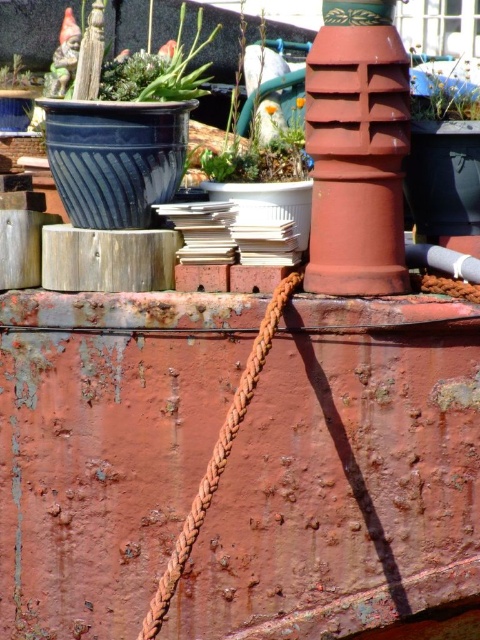
Does green matte plant at upper center appear under brown braided rope at center?

Incorrect, green matte plant at upper center is not positioned below brown braided rope at center.

Is green matte plant at upper center wider than brown braided rope at center?

No, green matte plant at upper center is not wider than brown braided rope at center.

Is point (248, 115) closer to camera compared to point (265, 339)?

That is False.

Where is `green matte plant at upper center`? This screenshot has height=640, width=480. green matte plant at upper center is located at coordinates (269, 120).

Is green matte plant at upper center taller than green leafy plant at upper right?

Yes, green matte plant at upper center is taller than green leafy plant at upper right.

Who is shorter, green matte plant at upper center or green leafy plant at upper right?

With less height is green leafy plant at upper right.

What do you see at coordinates (269, 120) in the screenshot?
I see `green matte plant at upper center` at bounding box center [269, 120].

Find the location of `green matte plant at upper center`. green matte plant at upper center is located at coordinates (269, 120).

Can you confirm if brown braided rope at center is smaller than green matte succulent at upper left?

Actually, brown braided rope at center might be larger than green matte succulent at upper left.

Between brown braided rope at center and green matte succulent at upper left, which one appears on the right side from the viewer's perspective?

brown braided rope at center is more to the right.

Image resolution: width=480 pixels, height=640 pixels. Find the location of `brown braided rope at center`. brown braided rope at center is located at coordinates point(217,456).

Where is `brown braided rope at center`? brown braided rope at center is located at coordinates (217, 456).